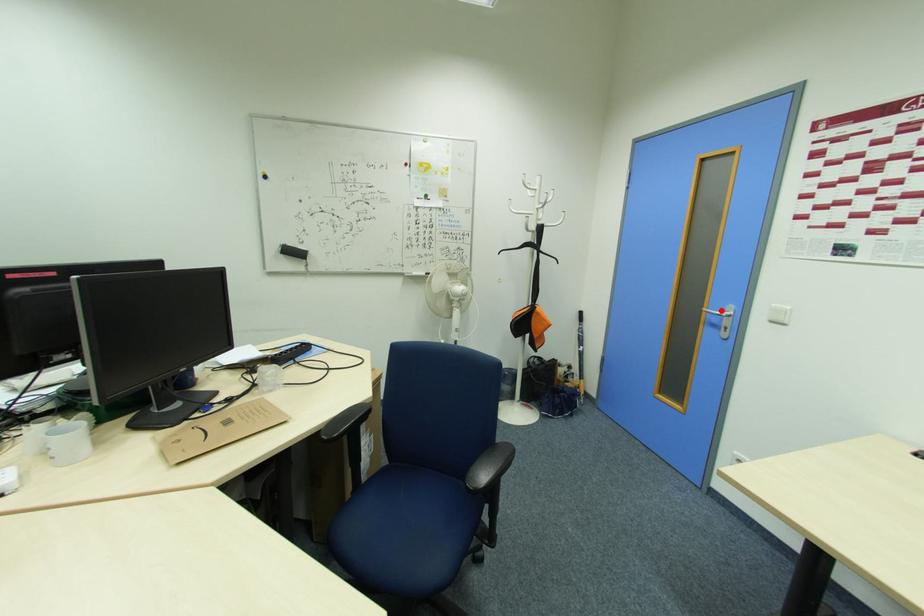
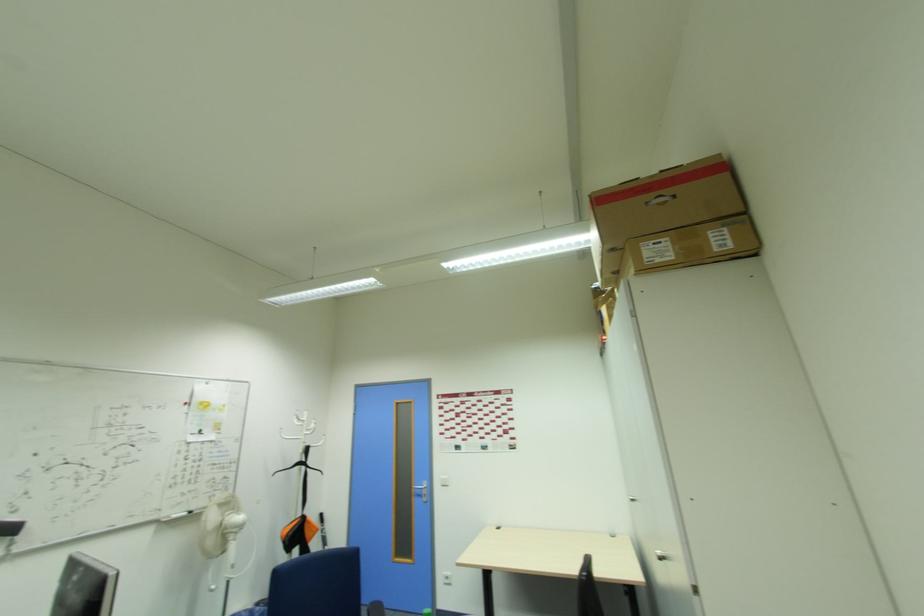
Where in the second image is the point corresponding to the highlighted location from the first image?

(421, 485)